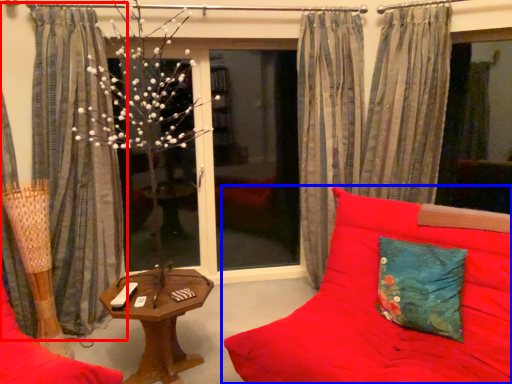
Question: Which object appears farthest to the camera in this image, curtain (highlighted by a red box) or studio couch (highlighted by a blue box)?

Choices:
 (A) curtain
 (B) studio couch

Answer: (A)